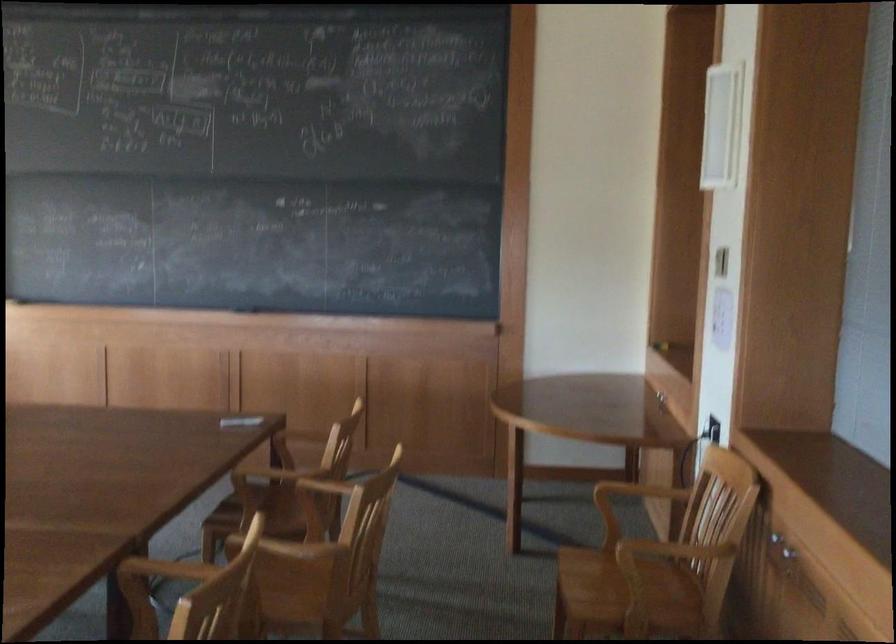
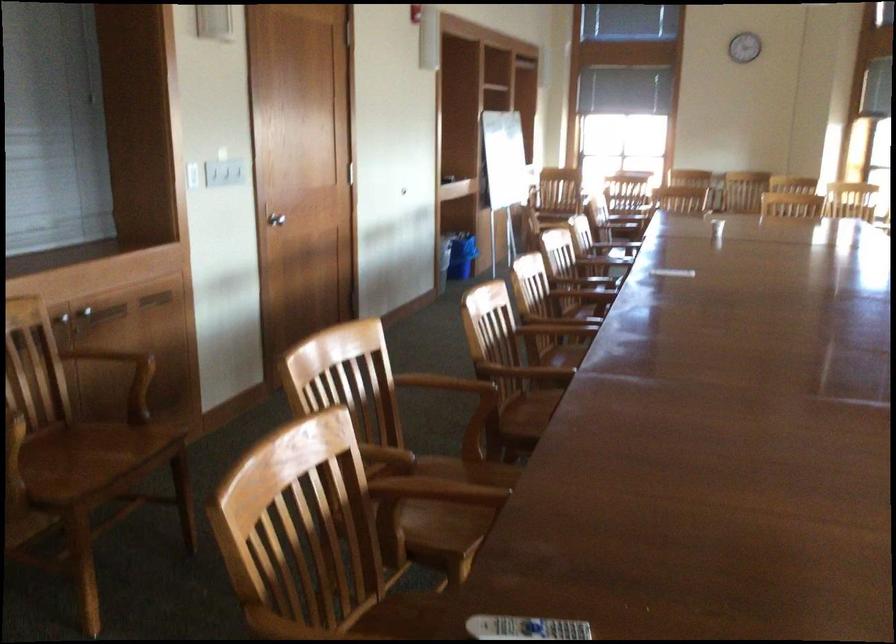
Where in the second image is the point corresponding to point (165, 518) from the first image?

(436, 489)